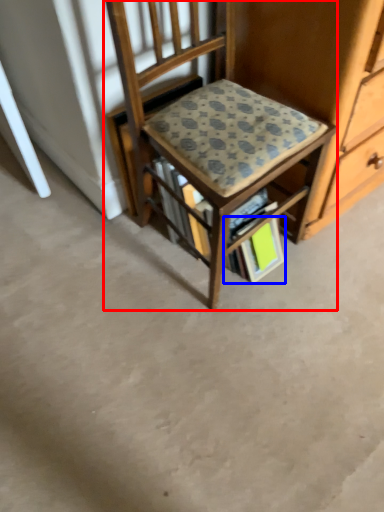
Question: Which object is closer to the camera taking this photo, chair (highlighted by a red box) or paperback book (highlighted by a blue box)?

Choices:
 (A) chair
 (B) paperback book

Answer: (A)